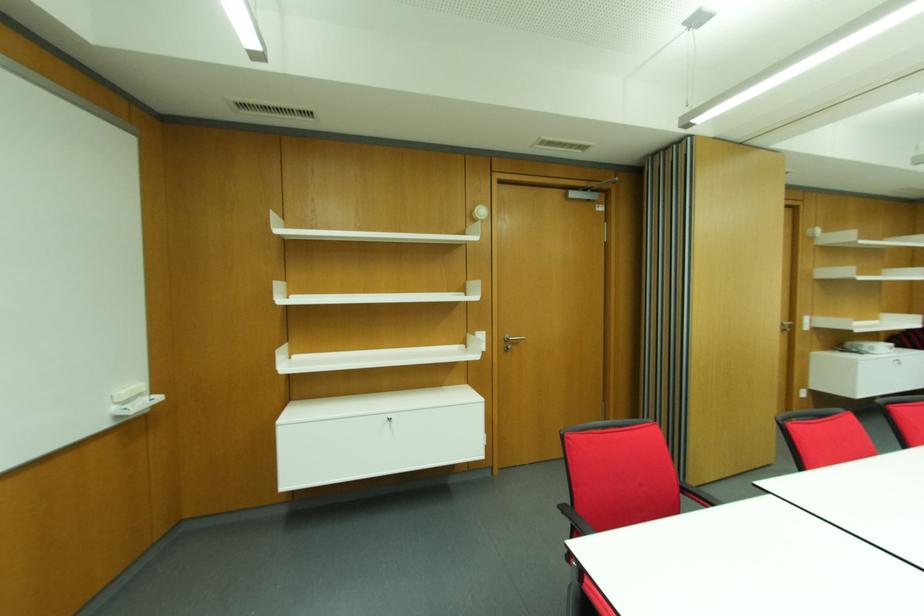
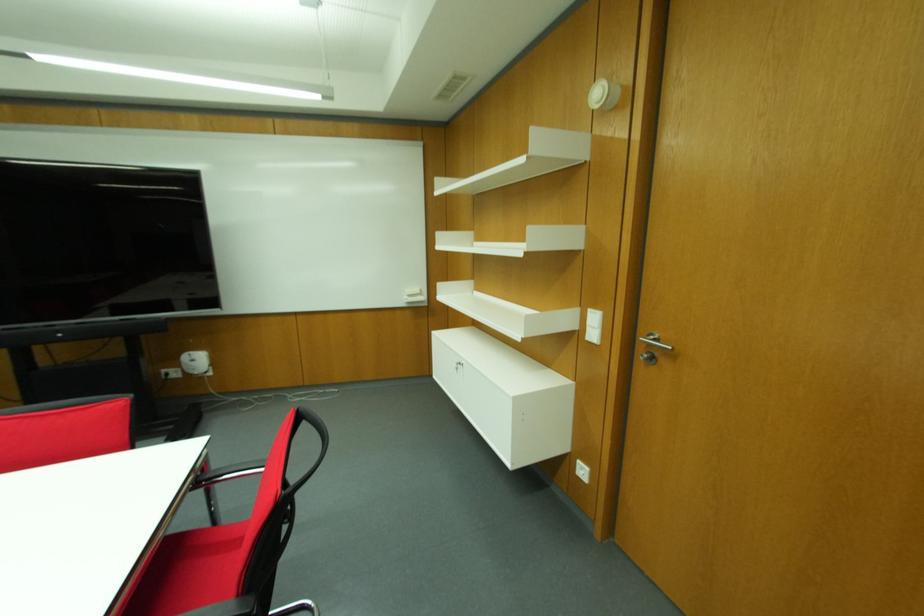
In the second image, find the point that corresponds to point 476,331 in the first image.

(589, 310)